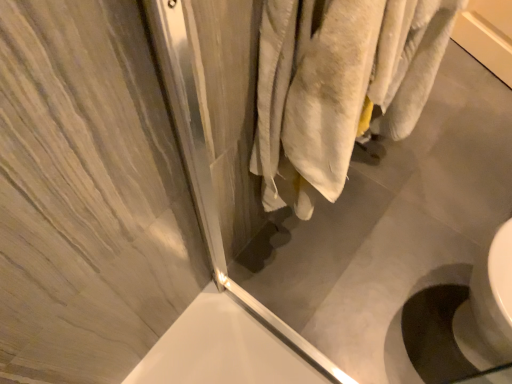
Question: In terms of height, does translucent glass screen door at upper right look taller or shorter compared to white glossy sink at lower right?

Choices:
 (A) short
 (B) tall

Answer: (B)

Question: From the image's perspective, is translucent glass screen door at upper right positioned above or below white glossy sink at lower right?

Choices:
 (A) below
 (B) above

Answer: (B)

Question: From a real-world perspective, is translucent glass screen door at upper right positioned above or below white glossy sink at lower right?

Choices:
 (A) above
 (B) below

Answer: (A)

Question: Is white glossy sink at lower right wider or thinner than translucent glass screen door at upper right?

Choices:
 (A) thin
 (B) wide

Answer: (B)

Question: Is white glossy sink at lower right inside the boundaries of translucent glass screen door at upper right, or outside?

Choices:
 (A) inside
 (B) outside

Answer: (B)

Question: In the image, is white glossy sink at lower right positioned in front of or behind translucent glass screen door at upper right?

Choices:
 (A) front
 (B) behind

Answer: (B)

Question: From the image's perspective, is white glossy sink at lower right located above or below translucent glass screen door at upper right?

Choices:
 (A) above
 (B) below

Answer: (B)